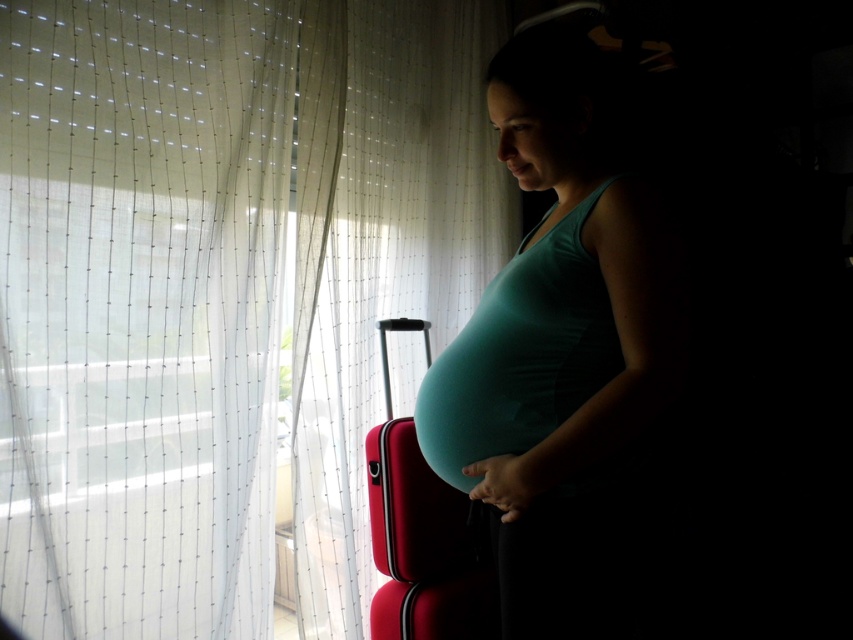
Between point (532, 100) and point (463, 579), which one is positioned behind?

The point (463, 579) is behind.

Looking at this image, which of these two, matte teal tank top at center or matte red suitcase at lower center, stands taller?

matte teal tank top at center

At what (x,y) coordinates should I click in order to perform the action: click on matte teal tank top at center. Please return your answer as a coordinate pair (x, y). This screenshot has width=853, height=640. Looking at the image, I should click on (573, 348).

Which of these two, white sheer curtain at left or matte teal tank top at center, stands taller?

white sheer curtain at left is taller.

What do you see at coordinates (221, 291) in the screenshot? This screenshot has width=853, height=640. I see `white sheer curtain at left` at bounding box center [221, 291].

This screenshot has width=853, height=640. Identify the location of white sheer curtain at left. (221, 291).

Does white sheer curtain at left have a larger size compared to matte red suitcase at center?

Yes.

Can you confirm if white sheer curtain at left is taller than matte red suitcase at center?

Yes, white sheer curtain at left is taller than matte red suitcase at center.

Identify the location of white sheer curtain at left. (221, 291).

This screenshot has height=640, width=853. In order to click on white sheer curtain at left in this screenshot , I will do `click(221, 291)`.